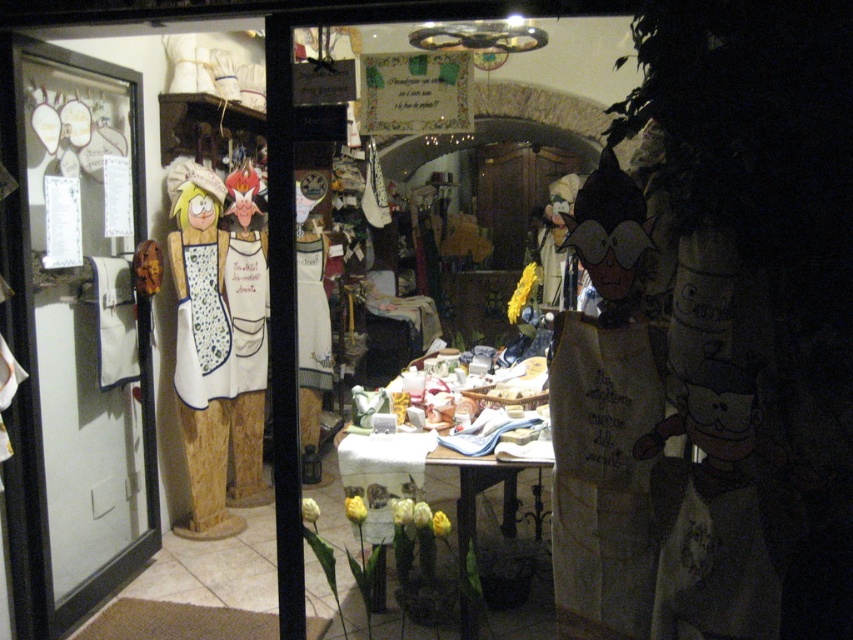
Does point (62, 627) come behind point (383, 49)?

No, it is in front of (383, 49).

Who is shorter, transparent glass door at left or matte white tablecloth at center?

matte white tablecloth at center is shorter.

Which is behind, point (45, 140) or point (525, 96)?

The point (525, 96) is more distant.

Locate an element on the screen. The height and width of the screenshot is (640, 853). transparent glass door at left is located at coordinates click(74, 333).